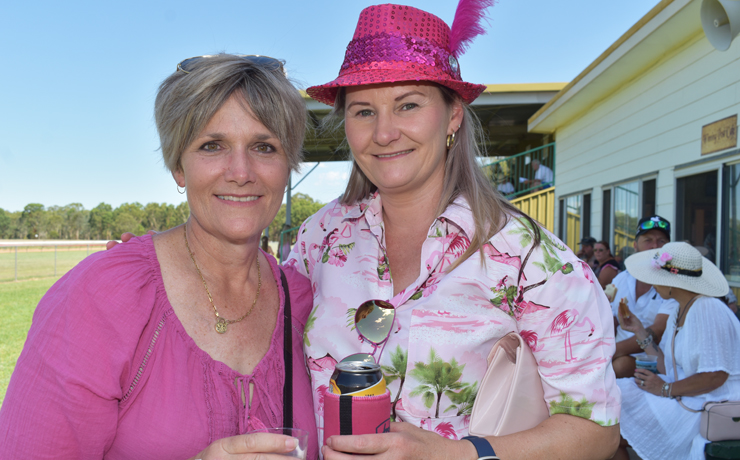
Find the location of a particular element. The image size is (740, 460). shades is located at coordinates (183, 61).